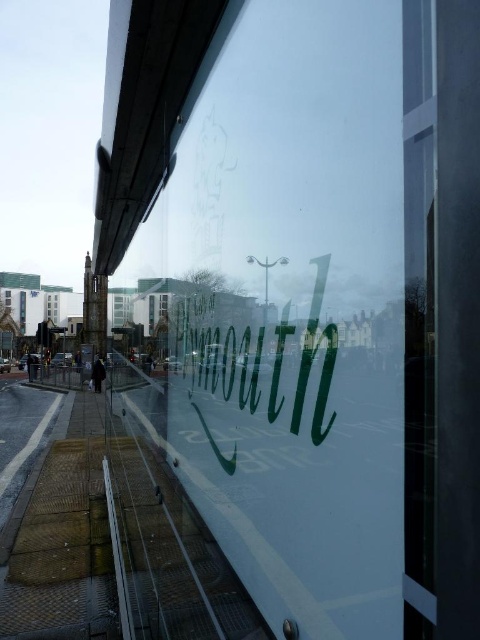
Question: Based on their relative distances, which object is nearer to the clear glass window at center?

Choices:
 (A) transparent glass window at center
 (B) transparent glass sign at center

Answer: (B)

Question: Which point is farther to the camera?

Choices:
 (A) (51, 310)
 (B) (160, 308)

Answer: (A)

Question: Can you confirm if clear glass window at center is positioned to the left of transparent glass window at center?

Choices:
 (A) yes
 (B) no

Answer: (A)

Question: Is clear glass window at center to the left of transparent glass window at center from the viewer's perspective?

Choices:
 (A) no
 (B) yes

Answer: (B)

Question: Which of the following is the farthest from the observer?

Choices:
 (A) transparent glass sign at center
 (B) clear glass window at center
 (C) transparent glass window at center

Answer: (B)

Question: Is clear glass window at center to the right of transparent glass window at center from the viewer's perspective?

Choices:
 (A) yes
 (B) no

Answer: (B)